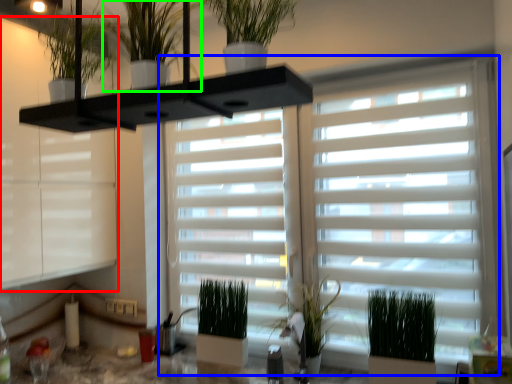
Question: Estimate the real-world distances between objects in this image. Which object is closer to window frame (highlighted by a red box), window blind (highlighted by a blue box) or houseplant (highlighted by a green box)?

Choices:
 (A) window blind
 (B) houseplant

Answer: (A)